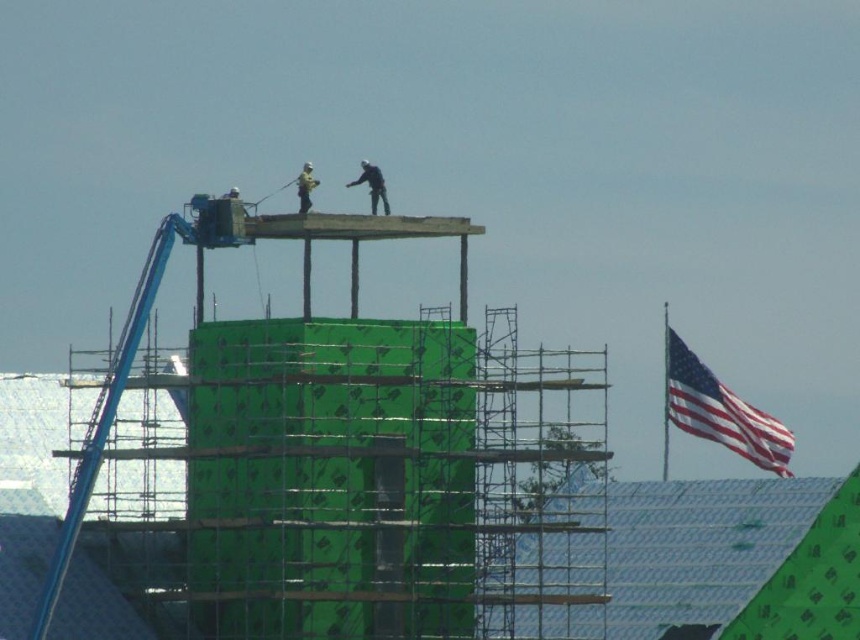
Question: Does american flag at right lie behind light brown wood construction worker at upper center?

Choices:
 (A) yes
 (B) no

Answer: (A)

Question: Does american flag at right appear over dark blue jeans at center?

Choices:
 (A) yes
 (B) no

Answer: (B)

Question: Estimate the real-world distances between objects in this image. Which object is farther from the light brown wood construction worker at upper center?

Choices:
 (A) american flag at right
 (B) dark blue jeans at center

Answer: (A)

Question: Which point is farther to the camera?

Choices:
 (A) dark blue jeans at center
 (B) light brown wood construction worker at upper center

Answer: (A)

Question: Is american flag at right further to camera compared to light brown wood construction worker at upper center?

Choices:
 (A) yes
 (B) no

Answer: (A)

Question: Which of the following is the farthest from the observer?

Choices:
 (A) (308, 205)
 (B) (774, 452)

Answer: (B)